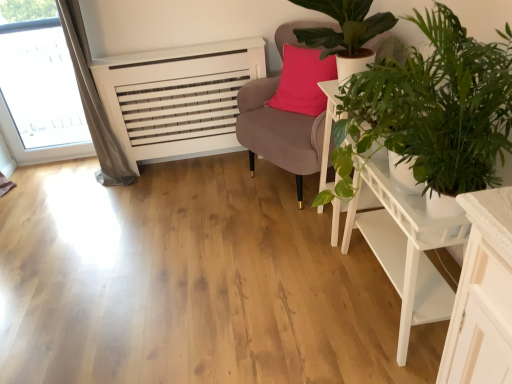
Question: Does velvet pink chair at upper right have a greater height compared to green leafy plant at upper right, which is counted as the second houseplant, starting from the front?

Choices:
 (A) no
 (B) yes

Answer: (B)

Question: Is velvet pink chair at upper right thinner than green leafy plant at upper right, the first houseplant viewed from the back?

Choices:
 (A) yes
 (B) no

Answer: (B)

Question: Does velvet pink chair at upper right lie behind green leafy plant at upper right, which is counted as the second houseplant, starting from the front?

Choices:
 (A) no
 (B) yes

Answer: (B)

Question: Considering the relative sizes of velvet pink chair at upper right and green leafy plant at upper right, which is counted as the second houseplant, starting from the front, in the image provided, is velvet pink chair at upper right bigger than green leafy plant at upper right, which is counted as the second houseplant, starting from the front,?

Choices:
 (A) no
 (B) yes

Answer: (B)

Question: Is velvet pink chair at upper right far away from green leafy plant at upper right, which is counted as the second houseplant, starting from the front?

Choices:
 (A) yes
 (B) no

Answer: (B)

Question: From the image's perspective, is velvet pink chair at upper right on top of green leafy plant at upper right, which is counted as the second houseplant, starting from the front?

Choices:
 (A) yes
 (B) no

Answer: (B)

Question: From the image's perspective, is velvet pink chair at upper right beneath green leafy plant at right, the 2th houseplant viewed from the back?

Choices:
 (A) no
 (B) yes

Answer: (A)

Question: Is velvet pink chair at upper right not inside green leafy plant at right, positioned as the 1th houseplant in front-to-back order?

Choices:
 (A) yes
 (B) no

Answer: (A)

Question: Considering the relative positions of velvet pink chair at upper right and green leafy plant at right, positioned as the 1th houseplant in front-to-back order, in the image provided, is velvet pink chair at upper right in front of green leafy plant at right, positioned as the 1th houseplant in front-to-back order,?

Choices:
 (A) no
 (B) yes

Answer: (A)

Question: Does velvet pink chair at upper right have a larger size compared to green leafy plant at right, positioned as the 1th houseplant in front-to-back order?

Choices:
 (A) no
 (B) yes

Answer: (B)

Question: From a real-world perspective, is velvet pink chair at upper right located beneath green leafy plant at right, the 2th houseplant viewed from the back?

Choices:
 (A) yes
 (B) no

Answer: (A)

Question: Is velvet pink chair at upper right at the left side of green leafy plant at right, positioned as the 1th houseplant in front-to-back order?

Choices:
 (A) no
 (B) yes

Answer: (B)

Question: Is velvet pink chair at upper right positioned behind white wooden side table at center right?

Choices:
 (A) no
 (B) yes

Answer: (B)